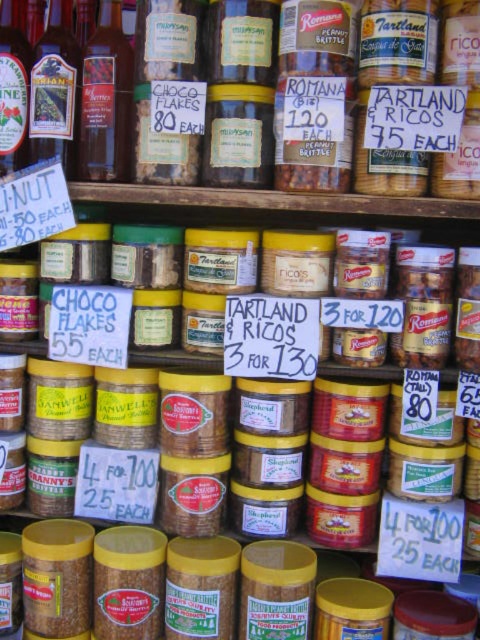
Can you confirm if matte glass bottle at upper left is positioned to the right of translucent glass bottle at center?

Yes, matte glass bottle at upper left is to the right of translucent glass bottle at center.

Is matte glass bottle at upper left taller than translucent glass bottle at center?

Incorrect, matte glass bottle at upper left's height is not larger of translucent glass bottle at center's.

Is point (34, 140) more distant than point (10, 116)?

Yes.

At what (x,y) coordinates should I click in order to perform the action: click on matte glass bottle at upper left. Please return your answer as a coordinate pair (x, y). Image resolution: width=480 pixels, height=640 pixels. Looking at the image, I should click on (55, 90).

Which is below, translucent glass bottle at upper left or translucent glass bottle at center?

Positioned lower is translucent glass bottle at upper left.

Is translucent glass bottle at upper left below translucent glass bottle at center?

Yes, translucent glass bottle at upper left is below translucent glass bottle at center.

Between point (124, 154) and point (17, 0), which one is positioned in front?

Point (124, 154)

Where is `translucent glass bottle at upper left`? This screenshot has height=640, width=480. translucent glass bottle at upper left is located at coordinates (106, 99).

Who is lower down, translucent glass bottle at upper left or matte glass bottle at upper left?

translucent glass bottle at upper left

Who is higher up, translucent glass bottle at upper left or matte glass bottle at upper left?

matte glass bottle at upper left is above.

Which is in front, point (86, 60) or point (63, 72)?

Point (63, 72) is in front.

Locate an element on the screen. This screenshot has width=480, height=640. translucent glass bottle at upper left is located at coordinates (106, 99).